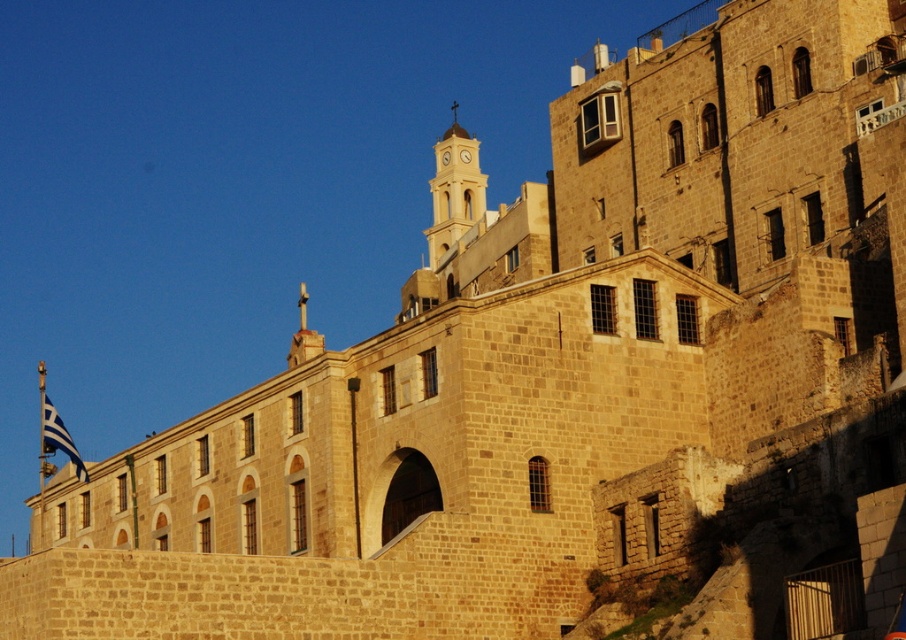
You are a tourist standing at the base of the yellow wooden clock at upper center, and you want to take a photo of the blue fabric flag at left. Given that your camera has a maximum zoom range of 60 meters, will you be able to capture the flag in your shot without moving closer?

The blue fabric flag at left is 67.54 meters from the yellow wooden clock at upper center. Since the camera can only zoom up to 60 meters, you will not be able to capture the flag without moving closer.

You are standing in front of the historic stone building and want to take a photo of the light brown stone clock tower at upper center and the blue fabric flag at left. Which object will appear larger in your photo?

The light brown stone clock tower at upper center will appear larger in the photo because it is closer to the viewer than the blue fabric flag at left.